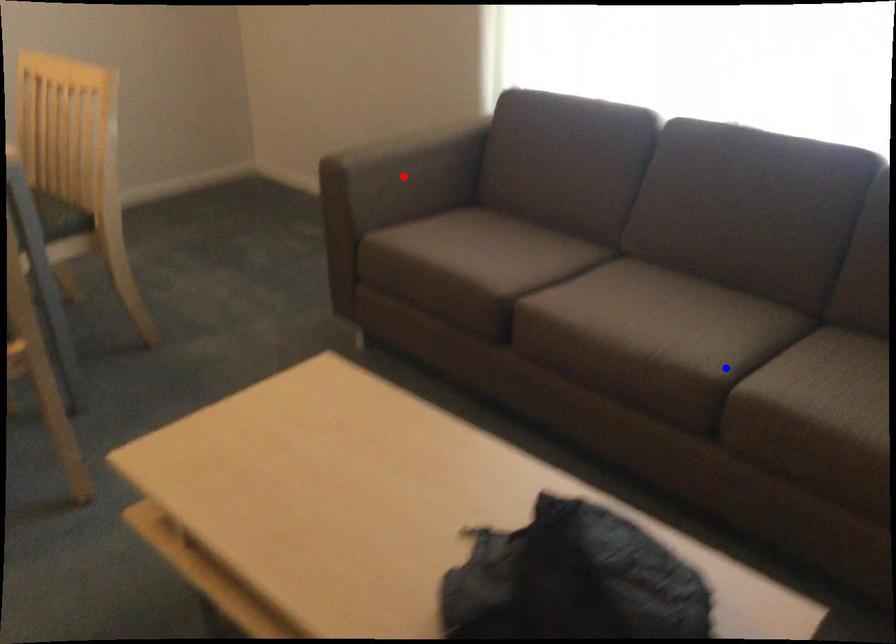
Question: Which of the two points in the image is closer to the camera?

Choices:
 (A) Blue point is closer.
 (B) Red point is closer.

Answer: (A)